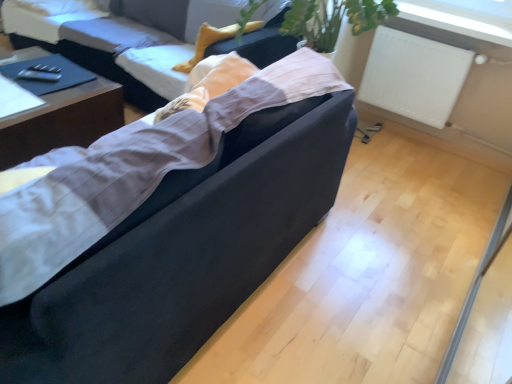
Question: In which direction should I rotate to look at velvet black couch at center, positioned as the second studio couch in front-to-back order?

Choices:
 (A) left
 (B) right

Answer: (A)

Question: Which direction should I rotate to look at suede-like black couch at center, the first studio couch positioned from the front?

Choices:
 (A) right
 (B) left

Answer: (B)

Question: From a real-world perspective, is velvet black couch at center, positioned as the second studio couch in front-to-back order, below dark wood table at left?

Choices:
 (A) no
 (B) yes

Answer: (A)

Question: Can you confirm if velvet black couch at center, marked as the first studio couch in a back-to-front arrangement, is thinner than dark wood table at left?

Choices:
 (A) yes
 (B) no

Answer: (B)

Question: Considering the relative sizes of velvet black couch at center, positioned as the second studio couch in front-to-back order, and dark wood table at left in the image provided, is velvet black couch at center, positioned as the second studio couch in front-to-back order, wider than dark wood table at left?

Choices:
 (A) yes
 (B) no

Answer: (A)

Question: Considering the relative sizes of velvet black couch at center, positioned as the second studio couch in front-to-back order, and dark wood table at left in the image provided, is velvet black couch at center, positioned as the second studio couch in front-to-back order, smaller than dark wood table at left?

Choices:
 (A) no
 (B) yes

Answer: (A)

Question: Is velvet black couch at center, marked as the first studio couch in a back-to-front arrangement, with dark wood table at left?

Choices:
 (A) no
 (B) yes

Answer: (A)

Question: Is dark wood table at left a part of velvet black couch at center, marked as the first studio couch in a back-to-front arrangement?

Choices:
 (A) yes
 (B) no

Answer: (B)

Question: Can you confirm if suede-like black couch at center, the first studio couch positioned from the front, is positioned to the left of dark wood table at left?

Choices:
 (A) yes
 (B) no

Answer: (B)

Question: Considering the relative sizes of suede-like black couch at center, the first studio couch positioned from the front, and dark wood table at left in the image provided, is suede-like black couch at center, the first studio couch positioned from the front, taller than dark wood table at left?

Choices:
 (A) yes
 (B) no

Answer: (A)

Question: Can you confirm if suede-like black couch at center, the second studio couch viewed from the back, is thinner than dark wood table at left?

Choices:
 (A) no
 (B) yes

Answer: (A)

Question: Considering the relative sizes of suede-like black couch at center, the second studio couch viewed from the back, and dark wood table at left in the image provided, is suede-like black couch at center, the second studio couch viewed from the back, shorter than dark wood table at left?

Choices:
 (A) yes
 (B) no

Answer: (B)

Question: Considering the relative sizes of suede-like black couch at center, the second studio couch viewed from the back, and dark wood table at left in the image provided, is suede-like black couch at center, the second studio couch viewed from the back, bigger than dark wood table at left?

Choices:
 (A) no
 (B) yes

Answer: (B)

Question: Is suede-like black couch at center, the first studio couch positioned from the front, positioned with its back to dark wood table at left?

Choices:
 (A) yes
 (B) no

Answer: (B)

Question: From the image's perspective, is suede-like black couch at center, the second studio couch viewed from the back, over white matte radiator at upper right?

Choices:
 (A) no
 (B) yes

Answer: (A)